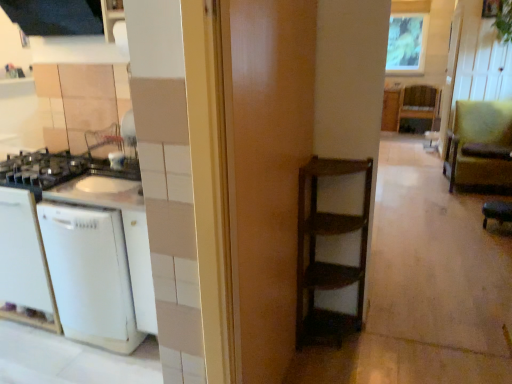
Question: From the image's perspective, is white matte dishwasher at left under wooden door at center?

Choices:
 (A) yes
 (B) no

Answer: (A)

Question: From a real-world perspective, does white matte dishwasher at left sit lower than wooden door at center?

Choices:
 (A) no
 (B) yes

Answer: (B)

Question: Can you confirm if white matte dishwasher at left is smaller than wooden door at center?

Choices:
 (A) no
 (B) yes

Answer: (A)

Question: Is white matte dishwasher at left directly adjacent to wooden door at center?

Choices:
 (A) yes
 (B) no

Answer: (B)

Question: Is white matte dishwasher at left positioned with its back to wooden door at center?

Choices:
 (A) yes
 (B) no

Answer: (B)

Question: Is green leather bar stool at lower right taller or shorter than wooden frame at upper center?

Choices:
 (A) tall
 (B) short

Answer: (B)

Question: Is green leather bar stool at lower right wider or thinner than wooden frame at upper center?

Choices:
 (A) wide
 (B) thin

Answer: (A)

Question: In the image, is green leather bar stool at lower right positioned in front of or behind wooden frame at upper center?

Choices:
 (A) behind
 (B) front

Answer: (B)

Question: Is point (492, 213) positioned closer to the camera than point (414, 39)?

Choices:
 (A) closer
 (B) farther

Answer: (A)

Question: Based on their positions, is wooden shelf at center located to the left or right of green fabric armchair at right?

Choices:
 (A) left
 (B) right

Answer: (B)

Question: Considering the positions of wooden shelf at center and green fabric armchair at right in the image, is wooden shelf at center taller or shorter than green fabric armchair at right?

Choices:
 (A) short
 (B) tall

Answer: (A)

Question: Looking at the image, does wooden shelf at center seem bigger or smaller compared to green fabric armchair at right?

Choices:
 (A) big
 (B) small

Answer: (B)

Question: From the image's perspective, is wooden shelf at center located above or below green fabric armchair at right?

Choices:
 (A) below
 (B) above

Answer: (B)

Question: Would you say white matte dishwasher at left is inside or outside green fabric armchair at right?

Choices:
 (A) inside
 (B) outside

Answer: (B)

Question: Looking at their shapes, would you say white matte dishwasher at left is wider or thinner than green fabric armchair at right?

Choices:
 (A) thin
 (B) wide

Answer: (A)